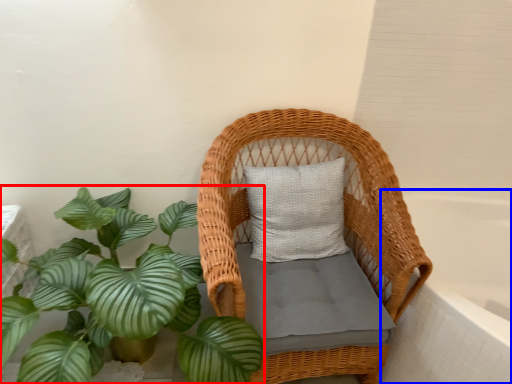
Question: Which of the following is the farthest to the observer, houseplant (highlighted by a red box) or bath (highlighted by a blue box)?

Choices:
 (A) houseplant
 (B) bath

Answer: (B)